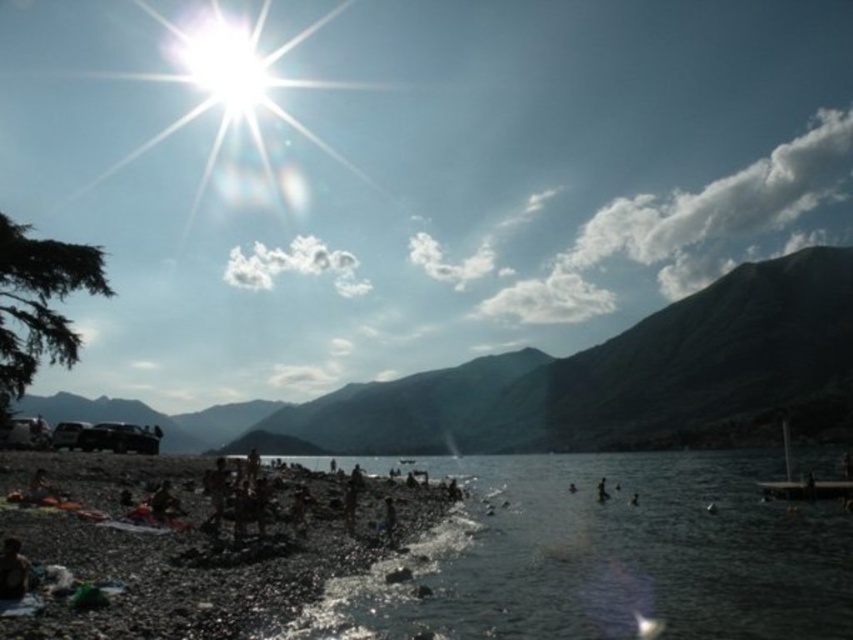
Who is shorter, clear water at lower center or smooth skin person at lower right?

smooth skin person at lower right is shorter.

Can you confirm if clear water at lower center is thinner than smooth skin person at lower right?

No, clear water at lower center is not thinner than smooth skin person at lower right.

Locate an element on the screen. The width and height of the screenshot is (853, 640). clear water at lower center is located at coordinates (606, 556).

Does green matte mountain at upper center come behind dark brown pebbles at lower left?

That is True.

In the scene shown: Who is shorter, green matte mountain at upper center or dark brown pebbles at lower left?

dark brown pebbles at lower left is shorter.

Between point (804, 256) and point (161, 538), which one is positioned in front?

Point (161, 538)

Find the location of `green matte mountain at upper center`. green matte mountain at upper center is located at coordinates (624, 378).

Which is above, green matte mountain at upper center or smooth skin person at lower right?

smooth skin person at lower right is above.

Does green matte mountain at upper center have a greater height compared to smooth skin person at lower right?

Yes.

Is point (843, 300) closer to camera compared to point (601, 486)?

No, it is behind (601, 486).

Locate an element on the screen. The image size is (853, 640). green matte mountain at upper center is located at coordinates coord(624,378).